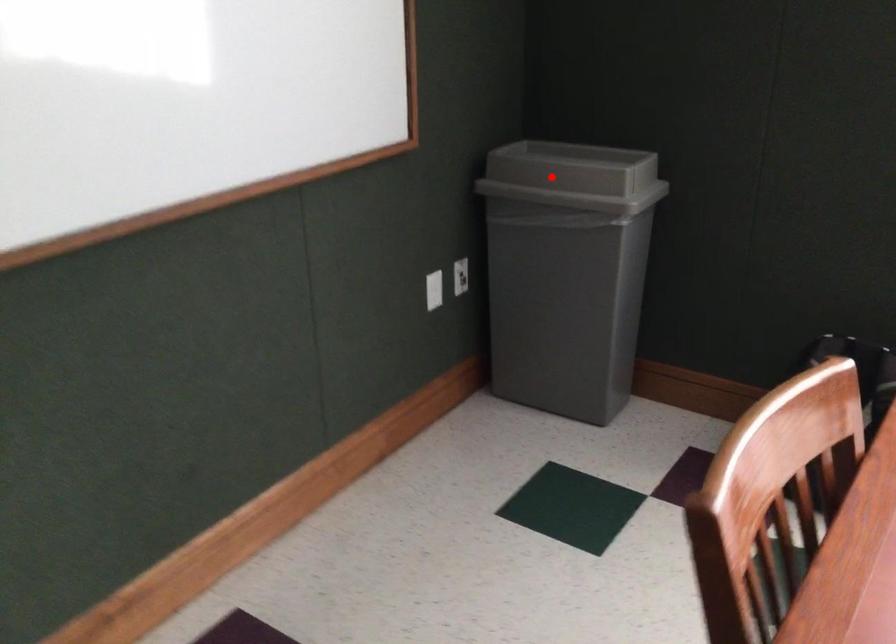
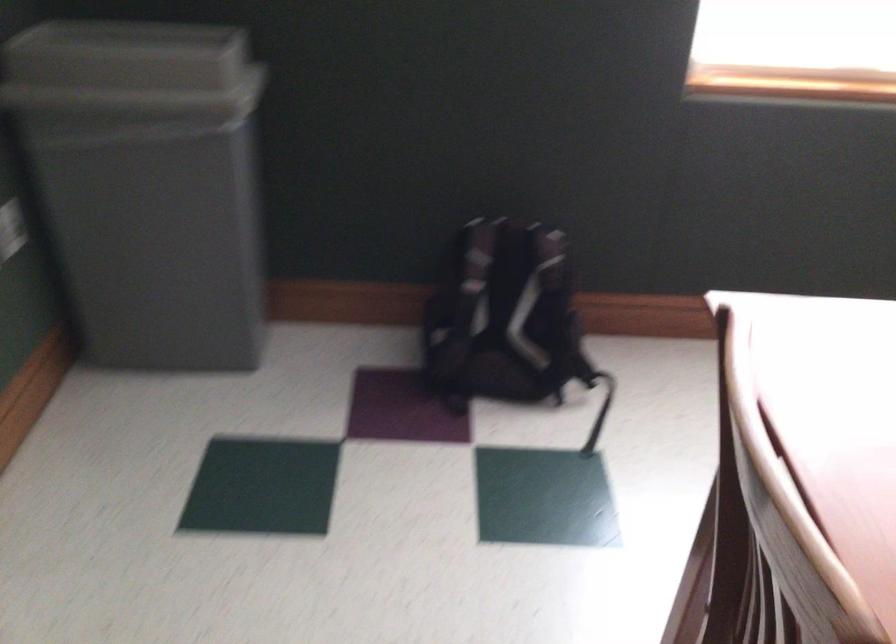
Question: I am providing you with two images of the same scene from different viewpoints. Image1 has a red point marked. In image2, the corresponding 3D location appears at what relative position? Reply with the corresponding letter.

Choices:
 (A) Closer
 (B) Farther

Answer: (A)